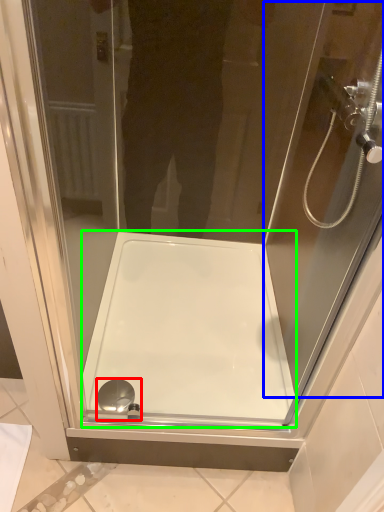
Question: Which object is positioned farthest from shower (highlighted by a red box)? Select from screen door (highlighted by a blue box) and bath (highlighted by a green box).

Choices:
 (A) screen door
 (B) bath

Answer: (A)